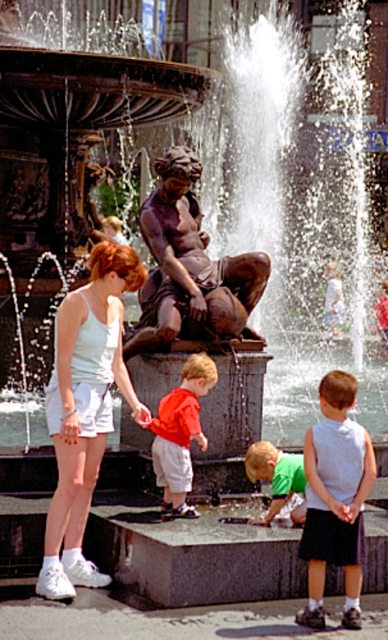
Does red cotton shirt at center have a smaller size compared to green t-shirt at lower center?

Incorrect, red cotton shirt at center is not smaller in size than green t-shirt at lower center.

Measure the distance between red cotton shirt at center and camera.

red cotton shirt at center is 31.34 meters away from camera.

I want to click on red cotton shirt at center, so click(180, 433).

Is white cotton tank top at center shorter than green t-shirt at lower center?

No, white cotton tank top at center is not shorter than green t-shirt at lower center.

Who is taller, white cotton tank top at center or green t-shirt at lower center?

Standing taller between the two is white cotton tank top at center.

Measure the distance between white cotton tank top at center and camera.

white cotton tank top at center and camera are 28.60 meters apart.

Image resolution: width=388 pixels, height=640 pixels. Find the location of `white cotton tank top at center`. white cotton tank top at center is located at coordinates (84, 410).

Who is lower down, white sleeveless shirt at center or red cotton shirt at center?

Positioned lower is white sleeveless shirt at center.

The height and width of the screenshot is (640, 388). In order to click on white sleeveless shirt at center in this screenshot , I will do (x=334, y=499).

This screenshot has width=388, height=640. What do you see at coordinates (334, 499) in the screenshot? I see `white sleeveless shirt at center` at bounding box center [334, 499].

You are a GUI agent. You are given a task and a screenshot of the screen. Output one action in this format:
    pyautogui.click(x=<x>, y=<y>)
    Task: Click on the white sleeveless shirt at center
    This screenshot has width=388, height=640.
    Given the screenshot: What is the action you would take?
    pyautogui.click(x=334, y=499)